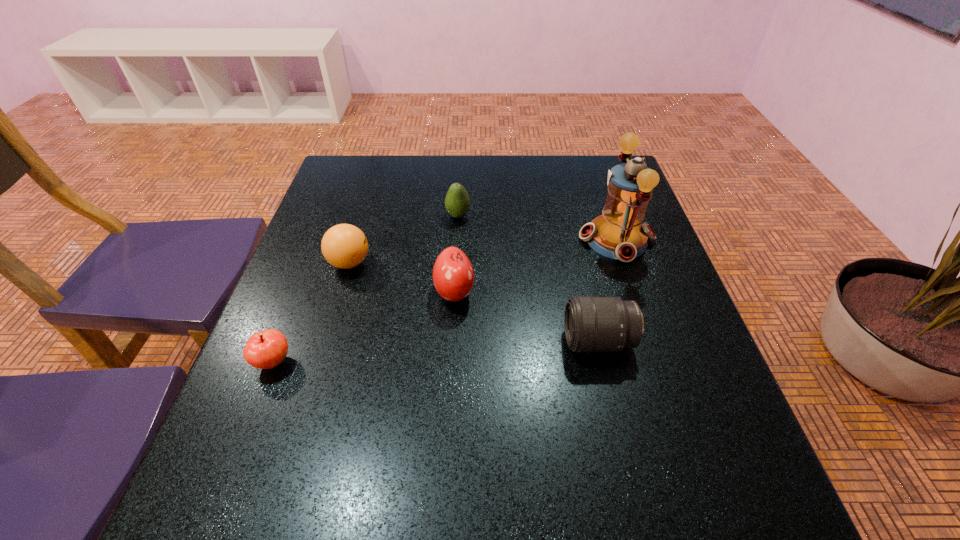
Locate an element on the screen. free space located on the front-facing side of the tallest object is located at coordinates [x=558, y=240].

At what (x,y) coordinates should I click in order to perform the action: click on free space located 0.240m on the right of the taller apple. Please return your answer as a coordinate pair (x, y). This screenshot has width=960, height=540. Looking at the image, I should click on (584, 292).

The width and height of the screenshot is (960, 540). In order to click on vacant space located 0.260m on the surface of the telephoto lens in this screenshot , I will do 433,341.

Locate an element on the screen. Image resolution: width=960 pixels, height=540 pixels. vacant space situated 0.050m on the surface of the telephoto lens is located at coordinates (540, 341).

You are a GUI agent. You are given a task and a screenshot of the screen. Output one action in this format:
    pyautogui.click(x=<x>, y=<y>)
    Task: Click on the vacant space positioned on the surface of the telephoto lens
    The width and height of the screenshot is (960, 540).
    Given the screenshot: What is the action you would take?
    click(398, 341)

I want to click on free space located 0.100m on the side with brand of the ping-pong ball, so click(x=414, y=263).

Find the location of `blank area located 0.080m on the front of the avocado`. blank area located 0.080m on the front of the avocado is located at coordinates (456, 243).

Where is `vacant space situated on the back of the left apple`? Image resolution: width=960 pixels, height=540 pixels. vacant space situated on the back of the left apple is located at coordinates (291, 318).

Image resolution: width=960 pixels, height=540 pixels. Find the location of `ping-pong ball positioned at the left edge`. ping-pong ball positioned at the left edge is located at coordinates (344, 246).

Locate an element on the screen. Image resolution: width=960 pixels, height=540 pixels. apple positioned at the left edge is located at coordinates (266, 349).